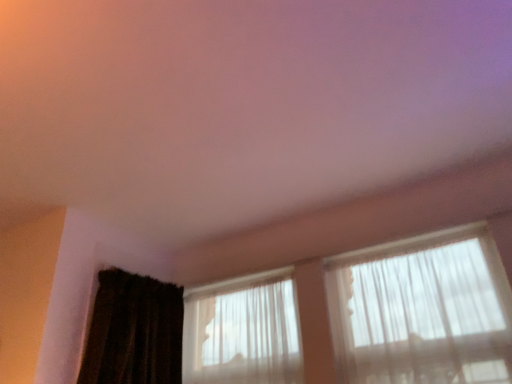
Question: Does translucent fabric window at center, the second window positioned from the right, have a lesser width compared to dark brown textured curtain at lower left?

Choices:
 (A) yes
 (B) no

Answer: (A)

Question: Considering the relative positions of translucent fabric window at center, the second window positioned from the right, and dark brown textured curtain at lower left in the image provided, is translucent fabric window at center, the second window positioned from the right, in front of dark brown textured curtain at lower left?

Choices:
 (A) yes
 (B) no

Answer: (B)

Question: Can you confirm if translucent fabric window at center, the second window positioned from the right, is shorter than dark brown textured curtain at lower left?

Choices:
 (A) yes
 (B) no

Answer: (A)

Question: Is translucent fabric window at center, the second window positioned from the right, not within dark brown textured curtain at lower left?

Choices:
 (A) yes
 (B) no

Answer: (A)

Question: From a real-world perspective, is translucent fabric window at center, the second window positioned from the right, beneath dark brown textured curtain at lower left?

Choices:
 (A) yes
 (B) no

Answer: (A)

Question: From their relative heights in the image, would you say translucent fabric at upper right, positioned as the 1th window in right-to-left order, is taller or shorter than translucent fabric window at center, the second window positioned from the right?

Choices:
 (A) tall
 (B) short

Answer: (A)

Question: Which is correct: translucent fabric at upper right, positioned as the 1th window in right-to-left order, is inside translucent fabric window at center, the second window positioned from the right, or outside of it?

Choices:
 (A) outside
 (B) inside

Answer: (A)

Question: From a real-world perspective, is translucent fabric at upper right, which ranks as the second window in left-to-right order, physically located above or below translucent fabric window at center, the second window positioned from the right?

Choices:
 (A) below
 (B) above

Answer: (A)

Question: Considering the relative positions of translucent fabric at upper right, which ranks as the second window in left-to-right order, and translucent fabric window at center, the second window positioned from the right, in the image provided, is translucent fabric at upper right, which ranks as the second window in left-to-right order, to the left or to the right of translucent fabric window at center, the second window positioned from the right,?

Choices:
 (A) left
 (B) right

Answer: (B)

Question: Considering their positions, is translucent fabric window at center, which is the first window from left to right, located in front of or behind translucent fabric at upper right, positioned as the 1th window in right-to-left order?

Choices:
 (A) behind
 (B) front

Answer: (A)

Question: From the image's perspective, is translucent fabric window at center, which is the first window from left to right, positioned above or below translucent fabric at upper right, positioned as the 1th window in right-to-left order?

Choices:
 (A) above
 (B) below

Answer: (B)

Question: Considering the positions of translucent fabric window at center, which is the first window from left to right, and translucent fabric at upper right, which ranks as the second window in left-to-right order, in the image, is translucent fabric window at center, which is the first window from left to right, wider or thinner than translucent fabric at upper right, which ranks as the second window in left-to-right order,?

Choices:
 (A) wide
 (B) thin

Answer: (B)

Question: Choose the correct answer: Is translucent fabric window at center, which is the first window from left to right, inside translucent fabric at upper right, positioned as the 1th window in right-to-left order, or outside it?

Choices:
 (A) outside
 (B) inside

Answer: (A)

Question: Visually, is dark brown textured curtain at lower left positioned to the left or to the right of translucent fabric at upper right, positioned as the 1th window in right-to-left order?

Choices:
 (A) left
 (B) right

Answer: (A)

Question: From a real-world perspective, is dark brown textured curtain at lower left positioned above or below translucent fabric at upper right, which ranks as the second window in left-to-right order?

Choices:
 (A) below
 (B) above

Answer: (B)